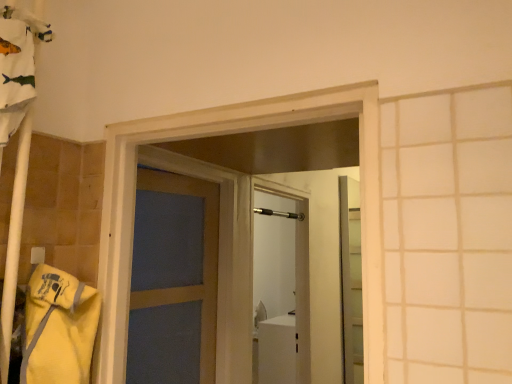
Question: Considering the relative positions of metallic silver shower at center and metallic elevator at right in the image provided, is metallic silver shower at center to the right of metallic elevator at right from the viewer's perspective?

Choices:
 (A) yes
 (B) no

Answer: (B)

Question: Is metallic silver shower at center surrounding metallic elevator at right?

Choices:
 (A) yes
 (B) no

Answer: (B)

Question: Is metallic silver shower at center located outside metallic elevator at right?

Choices:
 (A) no
 (B) yes

Answer: (B)

Question: Does metallic silver shower at center have a greater width compared to metallic elevator at right?

Choices:
 (A) no
 (B) yes

Answer: (B)

Question: Is metallic silver shower at center oriented away from metallic elevator at right?

Choices:
 (A) yes
 (B) no

Answer: (B)

Question: Considering the relative sizes of metallic silver shower at center and metallic elevator at right in the image provided, is metallic silver shower at center taller than metallic elevator at right?

Choices:
 (A) yes
 (B) no

Answer: (B)

Question: From a real-world perspective, is metallic elevator at right located higher than metallic silver shower at center?

Choices:
 (A) no
 (B) yes

Answer: (A)

Question: Does metallic elevator at right have a lesser width compared to metallic silver shower at center?

Choices:
 (A) no
 (B) yes

Answer: (B)

Question: Does metallic elevator at right appear on the left side of metallic silver shower at center?

Choices:
 (A) yes
 (B) no

Answer: (B)

Question: Is metallic elevator at right further to the viewer compared to metallic silver shower at center?

Choices:
 (A) yes
 (B) no

Answer: (A)

Question: Does metallic elevator at right have a greater height compared to metallic silver shower at center?

Choices:
 (A) no
 (B) yes

Answer: (B)

Question: Is metallic elevator at right completely or partially outside of metallic silver shower at center?

Choices:
 (A) no
 (B) yes

Answer: (B)

Question: Based on their sizes in the image, would you say metallic silver shower at center is bigger or smaller than metallic elevator at right?

Choices:
 (A) big
 (B) small

Answer: (B)